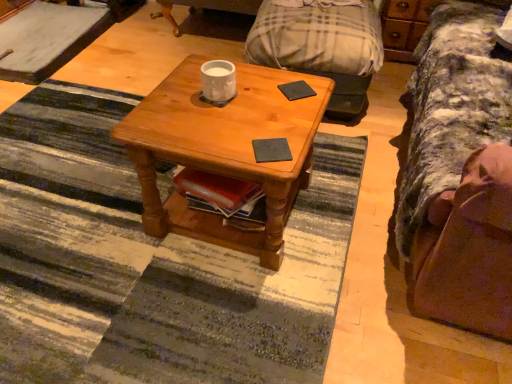
You are a GUI agent. You are given a task and a screenshot of the screen. Output one action in this format:
    pyautogui.click(x=<x>, y=<y>)
    Task: Click on the wooden dresser at upper right
    This screenshot has height=384, width=512.
    Given the screenshot: What is the action you would take?
    pyautogui.click(x=404, y=26)

The width and height of the screenshot is (512, 384). I want to click on white glossy mug at center, so click(x=218, y=81).

This screenshot has width=512, height=384. What do you see at coordinates (296, 90) in the screenshot? I see `black matte pad at center, the 1th pad in the back-to-front sequence` at bounding box center [296, 90].

I want to click on wooden dresser at upper right, so click(x=404, y=26).

Does point (506, 224) come behind point (410, 50)?

No, it is in front of (410, 50).

Considering the positions of objects brown fabric couch at right and wooden dresser at upper right in the image provided, who is behind, brown fabric couch at right or wooden dresser at upper right?

wooden dresser at upper right is further away from the camera.

Considering the relative sizes of brown fabric couch at right and wooden dresser at upper right in the image provided, is brown fabric couch at right bigger than wooden dresser at upper right?

Indeed, brown fabric couch at right has a larger size compared to wooden dresser at upper right.

Can wooden dresser at upper right be found inside brown fabric couch at right?

No.

From a real-world perspective, which object stands above the other?

In real-world perspective, brown fabric couch at right is above.

Is brown fabric couch at right turned away from wooden coffee table at center?

No, wooden coffee table at center is not at the back of brown fabric couch at right.

Consider the image. Is brown fabric couch at right positioned far away from wooden coffee table at center?

brown fabric couch at right is near wooden coffee table at center, not far away.

Is point (304, 96) positioned after point (397, 51)?

No, it is in front of (397, 51).

How many degrees apart are the facing directions of black matte pad at center, which is counted as the second pad, starting from the front, and wooden dresser at upper right?

The facing directions of black matte pad at center, which is counted as the second pad, starting from the front, and wooden dresser at upper right are 46.4 degrees apart.

Which of these two, black matte pad at center, which is counted as the second pad, starting from the front, or wooden dresser at upper right, is thinner?

black matte pad at center, which is counted as the second pad, starting from the front.

Is black matte pad at center, the first pad when ordered from top to bottom, oriented away from wooden dresser at upper right?

No.

From a real-world perspective, who is located higher, wooden dresser at upper right or black matte pad at center, the first pad when ordered from top to bottom?

black matte pad at center, the first pad when ordered from top to bottom, from a real-world perspective.

How many degrees apart are the facing directions of wooden dresser at upper right and black matte pad at center, the first pad when ordered from top to bottom?

The angle between the facing direction of wooden dresser at upper right and the facing direction of black matte pad at center, the first pad when ordered from top to bottom, is 46.4 degrees.

In the scene shown: From the image's perspective, between wooden dresser at upper right and black matte pad at center, the 1th pad in the back-to-front sequence, who is located below?

From the image's view, black matte pad at center, the 1th pad in the back-to-front sequence, is below.

Is wooden dresser at upper right next to black matte pad at center, which is counted as the second pad, starting from the front, and touching it?

No, wooden dresser at upper right is not touching black matte pad at center, which is counted as the second pad, starting from the front.

From a real-world perspective, is black matte pad at center, which ranks as the second pad in top-to-bottom order, positioned over wooden dresser at upper right based on gravity?

Indeed, from a real-world perspective, black matte pad at center, which ranks as the second pad in top-to-bottom order, stands above wooden dresser at upper right.

Is black matte pad at center, which is the second pad from back to front, aimed at wooden dresser at upper right?

No, black matte pad at center, which is the second pad from back to front, is not aimed at wooden dresser at upper right.

How different are the orientations of black matte pad at center, which is the second pad from back to front, and wooden dresser at upper right in degrees?

27.9 degrees.

Looking at the image, does black matte pad at center, which is the second pad from back to front, seem bigger or smaller compared to wooden dresser at upper right?

Clearly, black matte pad at center, which is the second pad from back to front, is smaller in size than wooden dresser at upper right.

Which object is closer to the camera, white glossy mug at center or wooden dresser at upper right?

white glossy mug at center.

Is white glossy mug at center positioned with its back to wooden dresser at upper right?

No, wooden dresser at upper right is not at the back of white glossy mug at center.

Considering the sizes of objects white glossy mug at center and wooden dresser at upper right in the image provided, who is wider, white glossy mug at center or wooden dresser at upper right?

wooden dresser at upper right is wider.

Find the location of a particular element. The image size is (512, 384). coffee cup that is above the wooden dresser at upper right (from a real-world perspective) is located at coordinates (218, 81).

Between brown fabric couch at right and black matte pad at center, which is counted as the second pad, starting from the front, which one is positioned behind?

black matte pad at center, which is counted as the second pad, starting from the front, is further away from the camera.

Could black matte pad at center, the 1th pad in the back-to-front sequence, be considered to be inside brown fabric couch at right?

No, black matte pad at center, the 1th pad in the back-to-front sequence, is located outside of brown fabric couch at right.

Could you tell me if brown fabric couch at right is facing black matte pad at center, the second pad from the bottom?

Yes, brown fabric couch at right is aimed at black matte pad at center, the second pad from the bottom.

Is point (506, 307) positioned in front of point (307, 85)?

That is True.

The width and height of the screenshot is (512, 384). I want to click on dresser behind the brown fabric couch at right, so click(404, 26).

The height and width of the screenshot is (384, 512). In order to click on coffee table below the brown fabric couch at right (from a real-world perspective) in this screenshot , I will do `click(224, 150)`.

When comparing their distances from black matte pad at center, the 1th pad in the back-to-front sequence, does black matte pad at center, which is the second pad from back to front, or white glossy mug at center seem closer?

The object closer to black matte pad at center, the 1th pad in the back-to-front sequence, is white glossy mug at center.

Considering their positions, is brown fabric couch at right positioned further to black matte pad at center, the first pad from the bottom, than wooden coffee table at center?

The object further to black matte pad at center, the first pad from the bottom, is brown fabric couch at right.

Looking at the image, which one is located further to white glossy mug at center, black matte pad at center, which ranks as the second pad in top-to-bottom order, or black matte pad at center, the 1th pad in the back-to-front sequence?

Based on the image, black matte pad at center, which ranks as the second pad in top-to-bottom order, appears to be further to white glossy mug at center.

From the picture: Looking at the image, which one is located further to black matte pad at center, the first pad when ordered from top to bottom, white glossy mug at center or brown fabric couch at right?

brown fabric couch at right lies further to black matte pad at center, the first pad when ordered from top to bottom, than the other object.

Consider the image. Based on their spatial positions, is black matte pad at center, which ranks as the second pad in top-to-bottom order, or brown fabric couch at right further from white glossy mug at center?

brown fabric couch at right is further to white glossy mug at center.

Estimate the real-world distances between objects in this image. Which object is further from wooden coffee table at center, brown fabric couch at right or wooden dresser at upper right?

The object further to wooden coffee table at center is wooden dresser at upper right.

Based on their spatial positions, is wooden coffee table at center or wooden dresser at upper right closer to white glossy mug at center?

wooden coffee table at center is closer to white glossy mug at center.

Which object lies nearer to the anchor point brown fabric couch at right, black matte pad at center, the first pad from the bottom, or wooden dresser at upper right?

The object closer to brown fabric couch at right is black matte pad at center, the first pad from the bottom.

Identify the location of pad between wooden coffee table at center and black matte pad at center, which is counted as the second pad, starting from the front, from front to back. This screenshot has width=512, height=384. (271, 150).

The width and height of the screenshot is (512, 384). I want to click on coffee table between brown fabric couch at right and wooden dresser at upper right from front to back, so click(224, 150).

Identify the location of pad between black matte pad at center, arranged as the 1th pad when viewed from the front, and brown fabric couch at right, in the horizontal direction. point(296,90).

What are the coordinates of `coffee table between white glossy mug at center and brown fabric couch at right` in the screenshot? It's located at (224, 150).